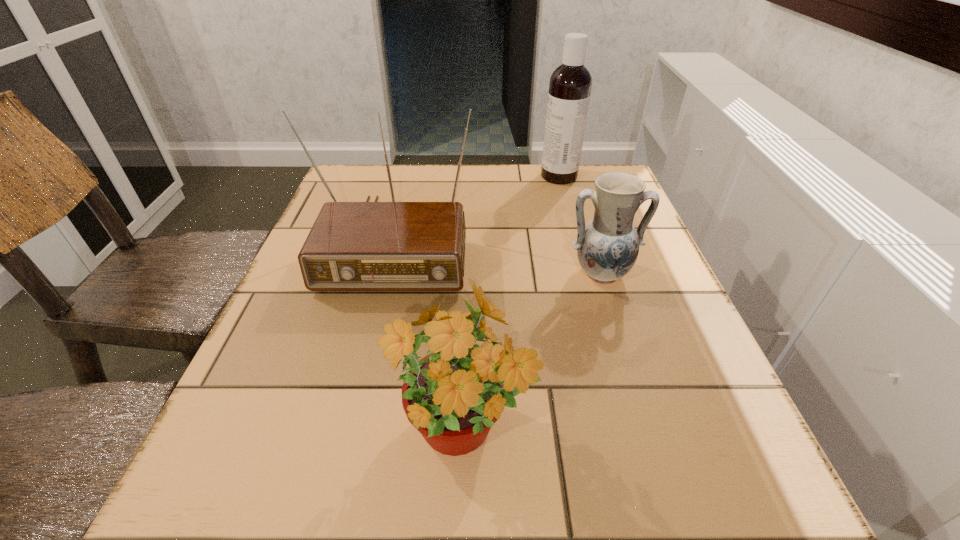
Where is `vacant space at the near edge of the desktop`? The width and height of the screenshot is (960, 540). vacant space at the near edge of the desktop is located at coordinates (330, 496).

Image resolution: width=960 pixels, height=540 pixels. In the image, there is a desktop. What are the coordinates of `free space at the left edge` in the screenshot? It's located at (348, 351).

Image resolution: width=960 pixels, height=540 pixels. Find the location of `vacant space at the right edge`. vacant space at the right edge is located at coordinates (693, 388).

I want to click on free region at the far left corner of the desktop, so (x=395, y=197).

Where is `vacant space at the near left corner`? This screenshot has height=540, width=960. vacant space at the near left corner is located at coordinates (265, 529).

Image resolution: width=960 pixels, height=540 pixels. I want to click on blank space at the near right corner, so click(x=733, y=497).

Where is `vacant space in between the radio_receiver and the pottery`? vacant space in between the radio_receiver and the pottery is located at coordinates 497,257.

The width and height of the screenshot is (960, 540). In order to click on vacant space that's between the flowerpot and the tallest object in this screenshot , I will do (x=511, y=305).

I want to click on empty space between the radio_receiver and the shortest object, so click(x=497, y=257).

You are a GUI agent. You are given a task and a screenshot of the screen. Output one action in this format:
    pyautogui.click(x=<x>, y=<y>)
    Task: Click on the free space between the nearest object and the dishwasher detergent
    Image resolution: width=960 pixels, height=540 pixels.
    Given the screenshot: What is the action you would take?
    pyautogui.click(x=511, y=305)